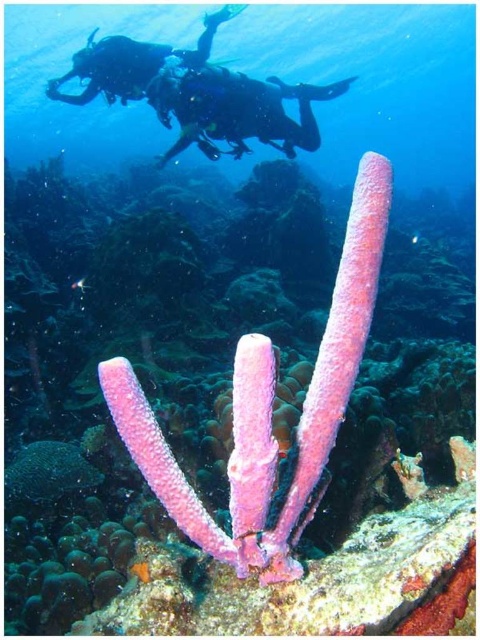
You are a marine biologist diving underwater and want to collect a sample from the pink sponge at center. Given that your sampling tool has a maximum reach of 3 feet, can you safely collect the sample without moving closer?

The pink sponge at center is 3.50 feet away from the viewer, which exceeds the sampling tool reach of 3 feet. Therefore, you cannot collect the sample without moving closer.

You are an underwater photographer aiming to capture a clear shot of both the matte black scuba diver at upper center and the matte black scuba diver at upper left. Considering their sizes in the frame, which diver should you focus on first to ensure they are in focus?

The matte black scuba diver at upper center is much taller than the matte black scuba diver at upper left, so you should focus on the matte black scuba diver at upper center first to ensure proper focus due to its larger size in the frame.